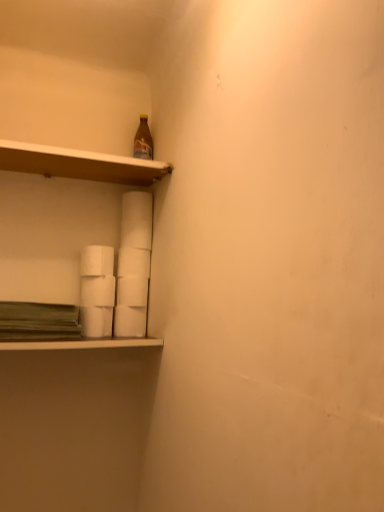
Question: Which direction should I rotate to look at white matte paper towel at center, the fourth paper towel from the top?

Choices:
 (A) left
 (B) right

Answer: (A)

Question: Does white matte paper towel at center, marked as the 4th paper towel in a bottom-to-top arrangement, appear on the left side of white matte paper towel at lower left, which ranks as the 6th paper towel in bottom-to-top order?

Choices:
 (A) yes
 (B) no

Answer: (B)

Question: Would you say white matte paper towel at center, marked as the 4th paper towel in a bottom-to-top arrangement, contains white matte paper towel at lower left, which ranks as the 6th paper towel in bottom-to-top order?

Choices:
 (A) yes
 (B) no

Answer: (B)

Question: Is white matte paper towel at center, marked as the 4th paper towel in a bottom-to-top arrangement, to the right of white matte paper towel at lower left, acting as the 1th paper towel starting from the top, from the viewer's perspective?

Choices:
 (A) yes
 (B) no

Answer: (A)

Question: From the image's perspective, is white matte paper towel at center, marked as the 4th paper towel in a bottom-to-top arrangement, below white matte paper towel at lower left, acting as the 1th paper towel starting from the top?

Choices:
 (A) no
 (B) yes

Answer: (B)

Question: Is white matte paper towel at center, the third paper towel viewed from the top, taller than white matte paper towel at lower left, acting as the 1th paper towel starting from the top?

Choices:
 (A) yes
 (B) no

Answer: (B)

Question: Would you say white matte paper towel at center, the third paper towel viewed from the top, is outside white matte paper towel at lower left, acting as the 1th paper towel starting from the top?

Choices:
 (A) yes
 (B) no

Answer: (A)

Question: From the image's perspective, is wooden shelf at upper left beneath white matte paper towel at center, placed as the third paper towel when sorted from bottom to top?

Choices:
 (A) no
 (B) yes

Answer: (A)

Question: Considering the relative sizes of wooden shelf at upper left and white matte paper towel at center, the fourth paper towel from the top, in the image provided, is wooden shelf at upper left smaller than white matte paper towel at center, the fourth paper towel from the top,?

Choices:
 (A) no
 (B) yes

Answer: (A)

Question: Would you say white matte paper towel at center, the fourth paper towel from the top, is part of wooden shelf at upper left's contents?

Choices:
 (A) yes
 (B) no

Answer: (B)

Question: Can you confirm if wooden shelf at upper left is positioned to the right of white matte paper towel at center, the fourth paper towel from the top?

Choices:
 (A) no
 (B) yes

Answer: (A)

Question: Considering the relative positions of wooden shelf at upper left and white matte paper towel at center, placed as the third paper towel when sorted from bottom to top, in the image provided, is wooden shelf at upper left to the left of white matte paper towel at center, placed as the third paper towel when sorted from bottom to top, from the viewer's perspective?

Choices:
 (A) yes
 (B) no

Answer: (A)

Question: Does wooden shelf at upper left come in front of white matte paper towel at center, the fourth paper towel from the top?

Choices:
 (A) yes
 (B) no

Answer: (A)

Question: From the image's perspective, is white matte paper towel at center, marked as the 4th paper towel in a bottom-to-top arrangement, over wooden shelf at upper left?

Choices:
 (A) yes
 (B) no

Answer: (B)